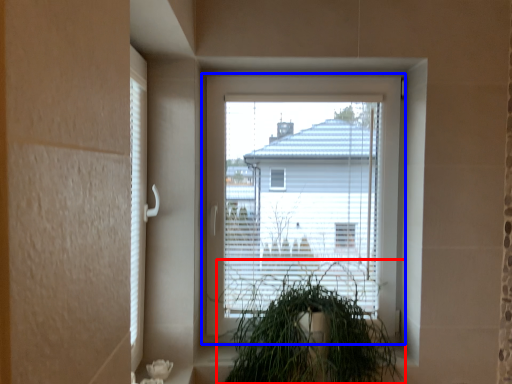
Question: Which object appears farthest to the camera in this image, houseplant (highlighted by a red box) or window (highlighted by a blue box)?

Choices:
 (A) houseplant
 (B) window

Answer: (B)